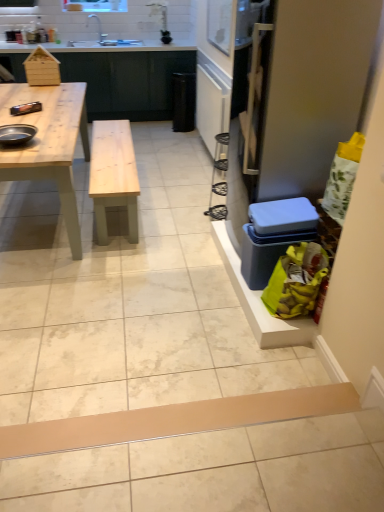
Where is `free area below natural wood table at left (from a real-world perspective)`? The image size is (384, 512). free area below natural wood table at left (from a real-world perspective) is located at coordinates (34, 219).